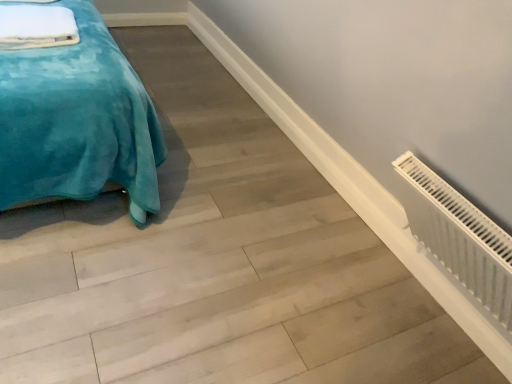
The image size is (512, 384). Describe the element at coordinates (36, 27) in the screenshot. I see `white soft sheet at upper left` at that location.

I want to click on white soft sheet at upper left, so [x=36, y=27].

Where is `white soft sheet at upper left`? The width and height of the screenshot is (512, 384). white soft sheet at upper left is located at coordinates (36, 27).